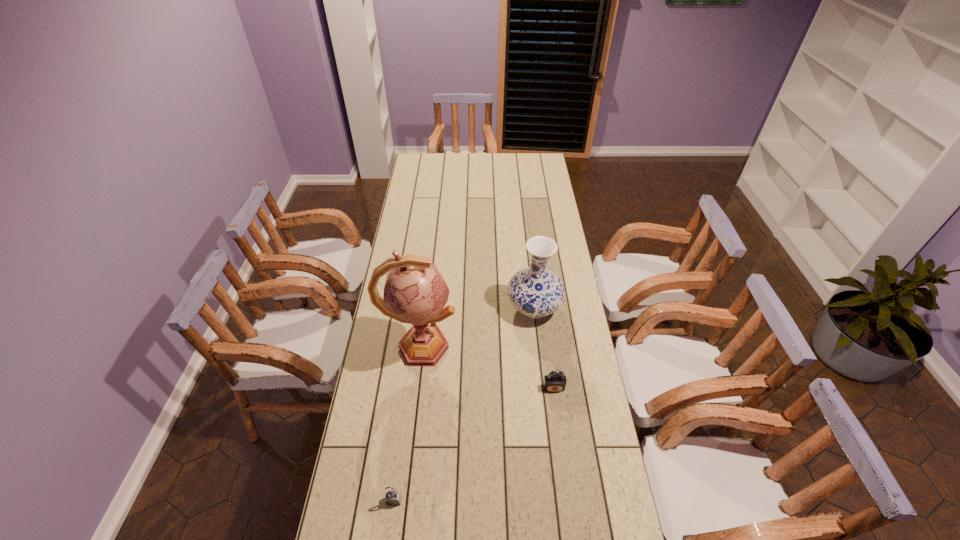
Identify the location of vacant space in between the tallest object and the third farthest object. (487, 367).

The height and width of the screenshot is (540, 960). In order to click on empty space that is in between the globe and the vase in this screenshot , I will do `click(477, 328)`.

The image size is (960, 540). I want to click on unoccupied area between the second tallest object and the nearer padlock, so click(464, 404).

Locate an element on the screen. The width and height of the screenshot is (960, 540). vacant area between the right padlock and the nearer padlock is located at coordinates (474, 444).

Locate an element on the screen. free space between the globe and the left padlock is located at coordinates (407, 424).

Locate an element on the screen. free space that is in between the nearest object and the globe is located at coordinates (407, 424).

Locate an element on the screen. Image resolution: width=960 pixels, height=540 pixels. vacant area that lies between the nearest object and the vase is located at coordinates (464, 404).

This screenshot has height=540, width=960. I want to click on free space between the globe and the nearer padlock, so click(407, 424).

Locate an element on the screen. object that is the second closest to the farther padlock is located at coordinates (415, 292).

You are a GUI agent. You are given a task and a screenshot of the screen. Output one action in this format:
    pyautogui.click(x=<x>, y=<y>)
    Task: Click on the object that can be found as the closest to the third farthest object
    
    Given the screenshot: What is the action you would take?
    pyautogui.click(x=535, y=291)